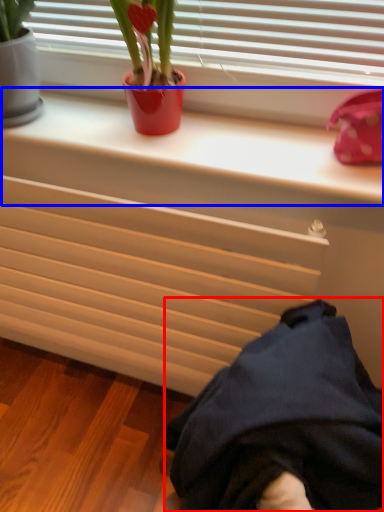
Question: Which of the following is the farthest to the observer, clothing (highlighted by a red box) or window sill (highlighted by a blue box)?

Choices:
 (A) clothing
 (B) window sill

Answer: (B)